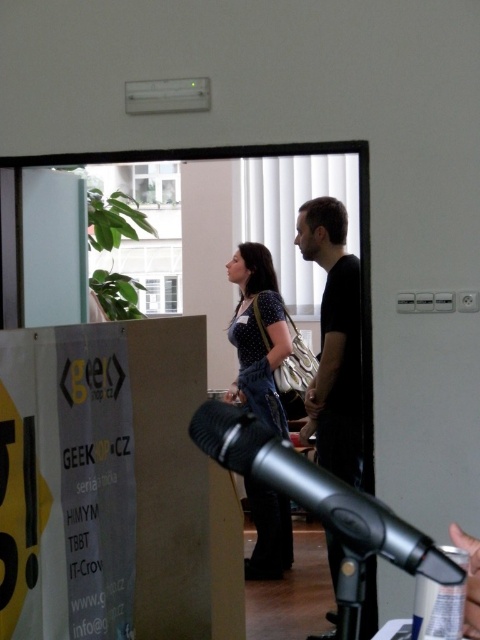
Question: Is silver metallic microphone at center to the left of polka dot blouse at center from the viewer's perspective?

Choices:
 (A) yes
 (B) no

Answer: (B)

Question: Considering the relative positions of black matte shirt at center and polka dot blouse at center in the image provided, where is black matte shirt at center located with respect to polka dot blouse at center?

Choices:
 (A) right
 (B) left

Answer: (A)

Question: Which point is farther from the camera taking this photo?

Choices:
 (A) (269, 269)
 (B) (264, 484)

Answer: (A)

Question: Which is farther from the black matte shirt at center?

Choices:
 (A) polka dot blouse at center
 (B) silver metallic microphone at center

Answer: (B)

Question: Which point appears closest to the camera in this image?

Choices:
 (A) (360, 468)
 (B) (251, 508)
 (C) (309, 468)

Answer: (C)

Question: Is silver metallic microphone at center positioned behind polka dot blouse at center?

Choices:
 (A) yes
 (B) no

Answer: (B)